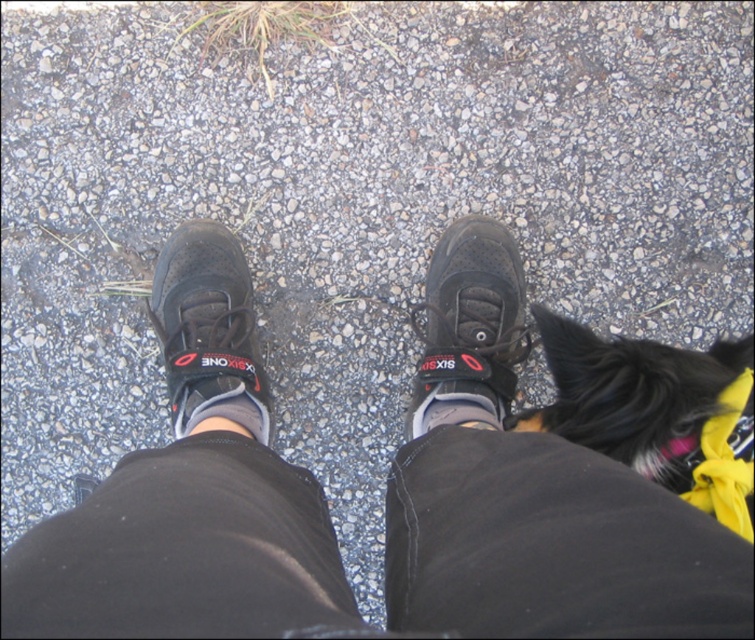
Is point (544, 417) more distant than point (464, 397)?

That is False.

Measure the distance between black fuzzy dog at lower right and white fabric sock at center.

The distance of black fuzzy dog at lower right from white fabric sock at center is 36.65 centimeters.

Image resolution: width=755 pixels, height=640 pixels. What do you see at coordinates (655, 412) in the screenshot?
I see `black fuzzy dog at lower right` at bounding box center [655, 412].

The width and height of the screenshot is (755, 640). I want to click on black fuzzy dog at lower right, so click(655, 412).

Is matte black shoe at center thinner than white fabric sock at center?

No, matte black shoe at center is not thinner than white fabric sock at center.

Can you confirm if matte black shoe at center is shorter than white fabric sock at center?

No, matte black shoe at center is not shorter than white fabric sock at center.

Who is more distant from viewer, (504, 332) or (488, 420)?

The point (504, 332) is more distant.

Where is `matte black shoe at center`? matte black shoe at center is located at coordinates (470, 326).

Can you confirm if matte black shoe at center is wider than matte black sneaker at left?

In fact, matte black shoe at center might be narrower than matte black sneaker at left.

Is point (461, 422) positioned behind point (233, 244)?

No, it is not.

Where is `matte black shoe at center`? The height and width of the screenshot is (640, 755). matte black shoe at center is located at coordinates (470, 326).